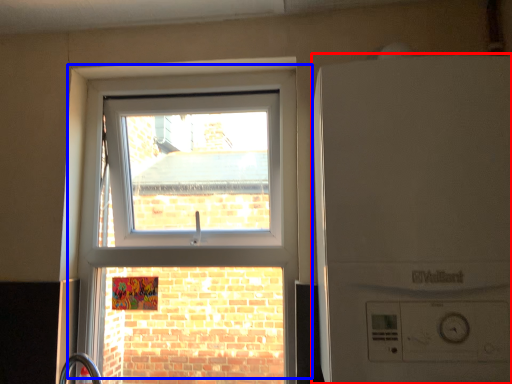
Question: Which object appears closest to the camera in this image, washing machine (highlighted by a red box) or window (highlighted by a blue box)?

Choices:
 (A) washing machine
 (B) window

Answer: (A)